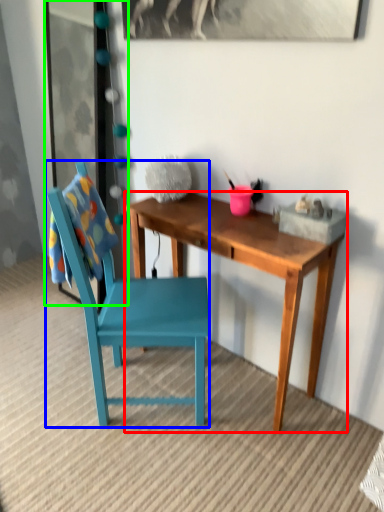
Question: Which object is positioned closest to desk (highlighted by a red box)? Select from chair (highlighted by a blue box) and glass door (highlighted by a green box).

Choices:
 (A) chair
 (B) glass door

Answer: (A)